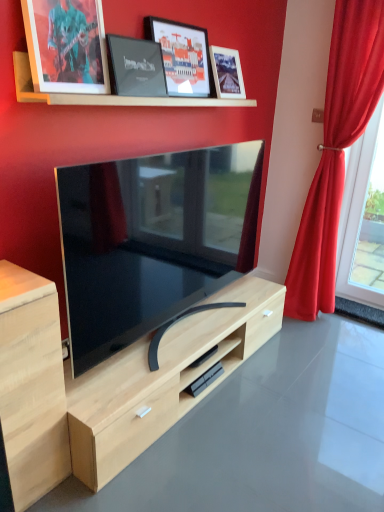
Locate an element on the screen. The height and width of the screenshot is (512, 384). vacant area that is in front of red velvet curtain at right is located at coordinates (325, 342).